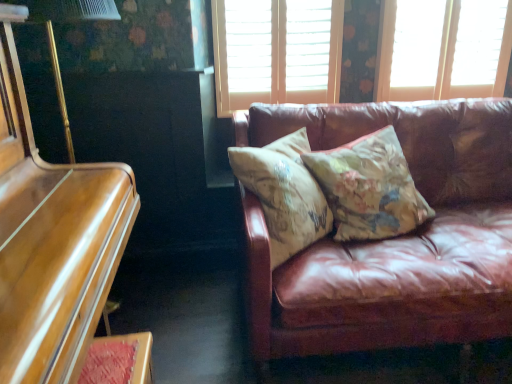
Question: Does matte white window at upper right, which is the 1th window in right-to-left order, come in front of wooden blinds at upper center, the 2th window viewed from the right?

Choices:
 (A) yes
 (B) no

Answer: (B)

Question: Is matte white window at upper right, which is the second window from left to right, aimed at wooden blinds at upper center, the 2th window viewed from the right?

Choices:
 (A) yes
 (B) no

Answer: (B)

Question: Is matte white window at upper right, which is the 1th window in right-to-left order, smaller than wooden blinds at upper center, the 2th window viewed from the right?

Choices:
 (A) no
 (B) yes

Answer: (A)

Question: Considering the relative sizes of matte white window at upper right, which is the second window from left to right, and wooden blinds at upper center, the 2th window viewed from the right, in the image provided, is matte white window at upper right, which is the second window from left to right, bigger than wooden blinds at upper center, the 2th window viewed from the right,?

Choices:
 (A) no
 (B) yes

Answer: (B)

Question: Is matte white window at upper right, which is the 1th window in right-to-left order, taller than wooden blinds at upper center, the 2th window viewed from the right?

Choices:
 (A) yes
 (B) no

Answer: (B)

Question: Based on their sizes in the image, would you say wooden blinds at upper center, the 2th window viewed from the right, is bigger or smaller than shiny brown piano at left?

Choices:
 (A) big
 (B) small

Answer: (B)

Question: From a real-world perspective, is wooden blinds at upper center, the 2th window viewed from the right, physically located above or below shiny brown piano at left?

Choices:
 (A) above
 (B) below

Answer: (A)

Question: Would you say wooden blinds at upper center, the 2th window viewed from the right, is to the left or to the right of shiny brown piano at left in the picture?

Choices:
 (A) left
 (B) right

Answer: (B)

Question: Does point (327, 61) appear closer or farther from the camera than point (82, 253)?

Choices:
 (A) closer
 (B) farther

Answer: (B)

Question: From a real-world perspective, is floral-patterned fabric pillow at center, the second pillow in the left-to-right sequence, physically located above or below matte white window at upper right, which is the 1th window in right-to-left order?

Choices:
 (A) below
 (B) above

Answer: (A)

Question: Considering the relative positions of floral-patterned fabric pillow at center, marked as the first pillow in a right-to-left arrangement, and matte white window at upper right, which is the 1th window in right-to-left order, in the image provided, is floral-patterned fabric pillow at center, marked as the first pillow in a right-to-left arrangement, to the left or to the right of matte white window at upper right, which is the 1th window in right-to-left order,?

Choices:
 (A) left
 (B) right

Answer: (A)

Question: Relative to matte white window at upper right, which is the second window from left to right, is floral-patterned fabric pillow at center, marked as the first pillow in a right-to-left arrangement, in front or behind?

Choices:
 (A) front
 (B) behind

Answer: (A)

Question: Considering the positions of point (408, 177) and point (440, 38), is point (408, 177) closer or farther from the camera than point (440, 38)?

Choices:
 (A) closer
 (B) farther

Answer: (A)

Question: Is point (101, 226) closer or farther from the camera than point (220, 72)?

Choices:
 (A) closer
 (B) farther

Answer: (A)

Question: From a real-world perspective, is shiny brown piano at left above or below wooden blinds at upper center, acting as the 1th window starting from the left?

Choices:
 (A) above
 (B) below

Answer: (B)